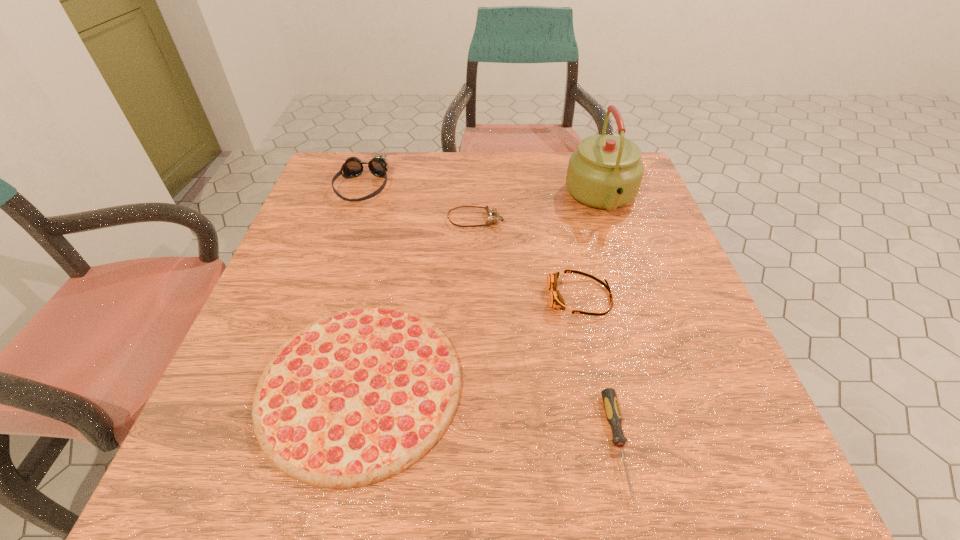
Image resolution: width=960 pixels, height=540 pixels. I want to click on the tallest object, so click(605, 172).

The image size is (960, 540). In order to click on the leftmost goggles in this screenshot , I will do `click(353, 167)`.

Image resolution: width=960 pixels, height=540 pixels. What are the coordinates of `the tallest goggles` in the screenshot? It's located at (353, 167).

At what (x,y) coordinates should I click in order to perform the action: click on the second shortest goggles. Please return your answer as a coordinate pair (x, y). Looking at the image, I should click on (556, 301).

Where is `the rightmost goggles`? the rightmost goggles is located at coordinates (556, 301).

Where is `the shortest goggles`? the shortest goggles is located at coordinates click(492, 212).

The width and height of the screenshot is (960, 540). Identify the location of the second farthest goggles. (492, 212).

At what (x,y) coordinates should I click in order to perform the action: click on pizza. Please return your answer as a coordinate pair (x, y). The width and height of the screenshot is (960, 540). Looking at the image, I should click on (357, 396).

I want to click on screwdriver, so click(x=612, y=410).

Locate an element on the screen. The width and height of the screenshot is (960, 540). free space located at the spout of the kettle is located at coordinates (635, 295).